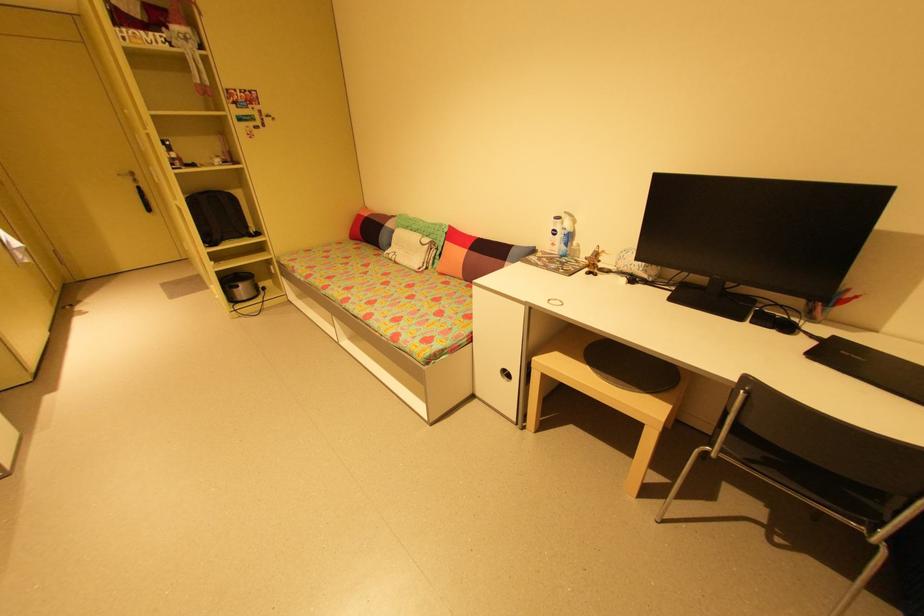
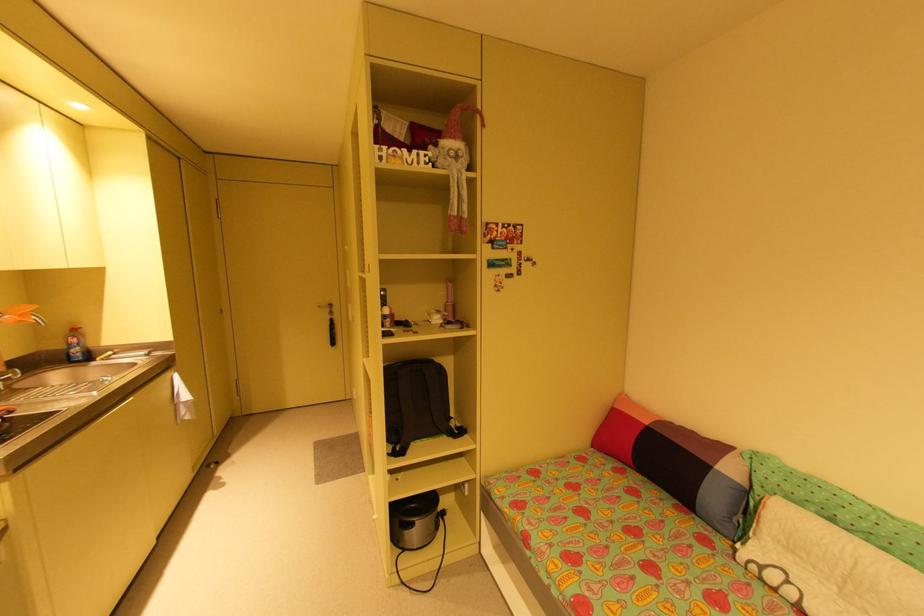
In the second image, find the point that corresponds to pixel 242 286 in the first image.

(417, 525)